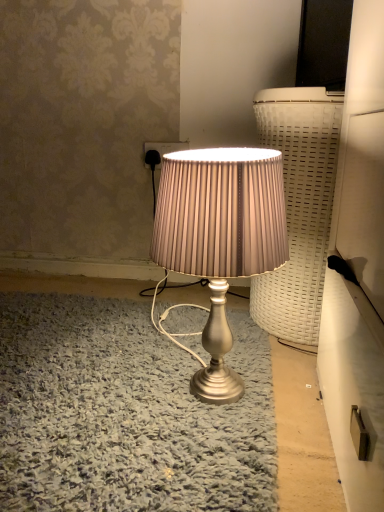
Question: Visually, is satin silver lamp at center positioned to the left or to the right of matte black socket at upper center?

Choices:
 (A) right
 (B) left

Answer: (A)

Question: Based on their sizes in the image, would you say satin silver lamp at center is bigger or smaller than matte black socket at upper center?

Choices:
 (A) big
 (B) small

Answer: (A)

Question: Is satin silver lamp at center in front of or behind matte black socket at upper center in the image?

Choices:
 (A) front
 (B) behind

Answer: (A)

Question: Is point (157, 150) positioned closer to the camera than point (193, 376)?

Choices:
 (A) closer
 (B) farther

Answer: (B)

Question: From the image's perspective, relative to satin silver lamp at center, is matte black socket at upper center above or below?

Choices:
 (A) below
 (B) above

Answer: (B)

Question: Would you say matte black socket at upper center is to the left or to the right of satin silver lamp at center in the picture?

Choices:
 (A) left
 (B) right

Answer: (A)

Question: Considering the positions of matte black socket at upper center and satin silver lamp at center in the image, is matte black socket at upper center bigger or smaller than satin silver lamp at center?

Choices:
 (A) big
 (B) small

Answer: (B)